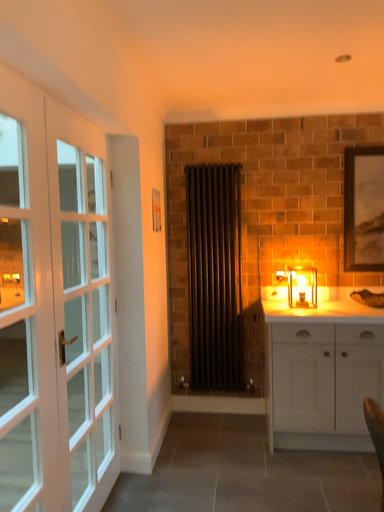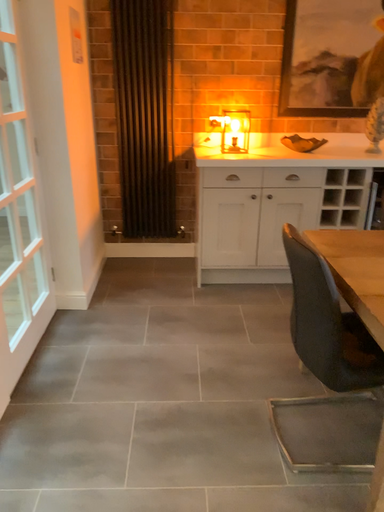
Question: Which way did the camera rotate in the video?

Choices:
 (A) rotated downward
 (B) rotated upward

Answer: (A)